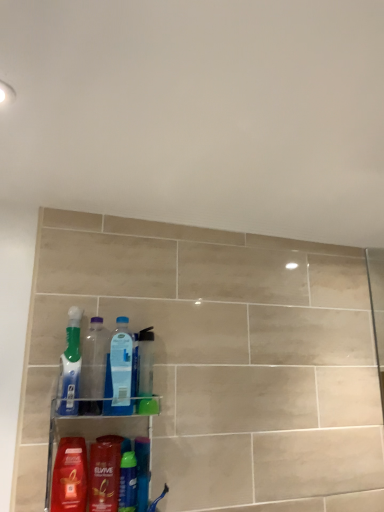
Question: From the image's perspective, is translucent plastic toothbrush at left, which is counted as the 2th cleaning product, starting from the bottom, beneath translucent plastic bottles at lower center?

Choices:
 (A) yes
 (B) no

Answer: (B)

Question: Would you say translucent plastic bottles at lower center is part of translucent plastic toothbrush at left, which is counted as the 2th cleaning product, starting from the bottom,'s contents?

Choices:
 (A) no
 (B) yes

Answer: (A)

Question: Can you confirm if translucent plastic toothbrush at left, which is counted as the 2th cleaning product, starting from the bottom, is positioned to the right of translucent plastic bottles at lower center?

Choices:
 (A) no
 (B) yes

Answer: (A)

Question: Does translucent plastic toothbrush at left, positioned as the first cleaning product in top-to-bottom order, have a smaller size compared to translucent plastic bottles at lower center?

Choices:
 (A) yes
 (B) no

Answer: (A)

Question: Is translucent plastic toothbrush at left, which is counted as the 2th cleaning product, starting from the bottom, wider than translucent plastic bottles at lower center?

Choices:
 (A) no
 (B) yes

Answer: (A)

Question: Visually, is translucent plastic bottles at lower center positioned to the left or to the right of translucent plastic mouthwash at lower center, placed as the second mouthwash when sorted from right to left?

Choices:
 (A) left
 (B) right

Answer: (B)

Question: Based on their sizes in the image, would you say translucent plastic bottles at lower center is bigger or smaller than translucent plastic mouthwash at lower center, the first mouthwash from the left?

Choices:
 (A) big
 (B) small

Answer: (A)

Question: Is translucent plastic bottles at lower center in front of or behind translucent plastic mouthwash at lower center, placed as the second mouthwash when sorted from right to left, in the image?

Choices:
 (A) front
 (B) behind

Answer: (A)

Question: From a real-world perspective, relative to translucent plastic mouthwash at lower center, placed as the second mouthwash when sorted from right to left, is translucent plastic bottles at lower center vertically above or below?

Choices:
 (A) above
 (B) below

Answer: (A)

Question: In terms of height, does translucent plastic bottles at lower center look taller or shorter compared to transparent plastic bottle at center, positioned as the first bottle in right-to-left order?

Choices:
 (A) short
 (B) tall

Answer: (B)

Question: In the image, is translucent plastic bottles at lower center positioned in front of or behind transparent plastic bottle at center, marked as the second bottle in a left-to-right arrangement?

Choices:
 (A) front
 (B) behind

Answer: (A)

Question: Is translucent plastic bottles at lower center wider or thinner than transparent plastic bottle at center, marked as the second bottle in a left-to-right arrangement?

Choices:
 (A) wide
 (B) thin

Answer: (A)

Question: Would you say translucent plastic bottles at lower center is to the left or to the right of transparent plastic bottle at center, positioned as the first bottle in right-to-left order, in the picture?

Choices:
 (A) right
 (B) left

Answer: (B)

Question: Based on their positions, is translucent plastic bottle at lower center located to the left or right of transparent plastic bottle at center, marked as the 2th bottle in a right-to-left arrangement?

Choices:
 (A) left
 (B) right

Answer: (B)

Question: From the image's perspective, relative to transparent plastic bottle at center, placed as the first bottle when sorted from left to right, is translucent plastic bottle at lower center above or below?

Choices:
 (A) below
 (B) above

Answer: (A)